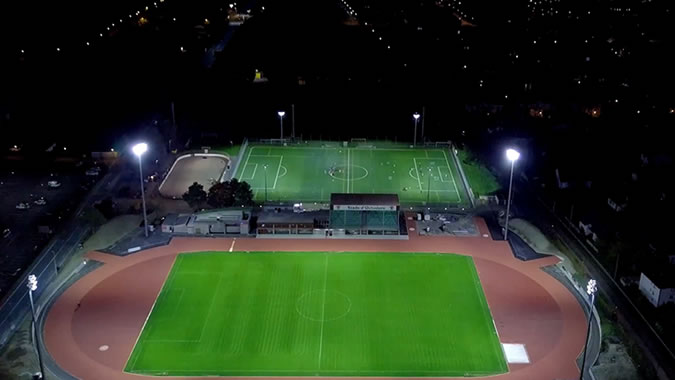
Where is `lights`? This screenshot has width=675, height=380. lights is located at coordinates (128, 22).